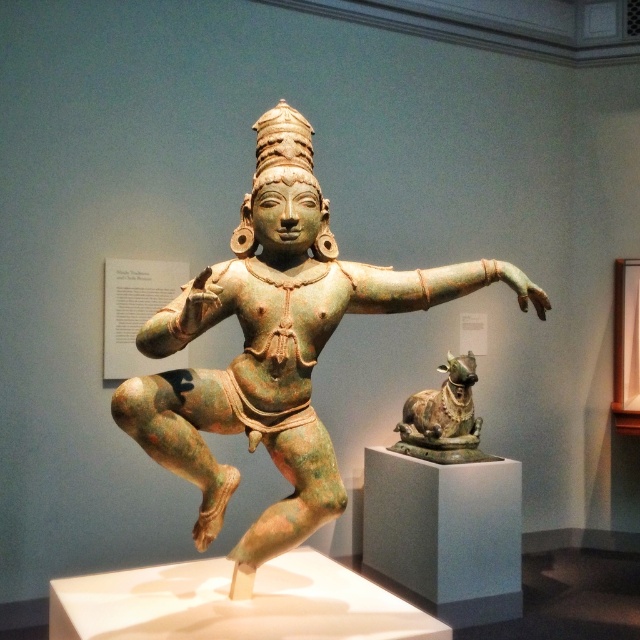
You are a museum curator planning to move the green patinated bronze statue at center and the green patinated bronze bull at center to a new exhibition space. The new space has a narrow corridor that can only accommodate items up to 1.2 meters in width. Based on the information provided, can both sculptures fit through the corridor without needing to be modified?

The green patinated bronze statue at center might be wider than the green patinated bronze bull at center. Since the corridor can only accommodate items up to 1.2 meters in width, there is a possibility that the statue at center may exceed the width limit. Therefore, it is uncertain if both sculptures can fit without modification without knowing their exact dimensions.